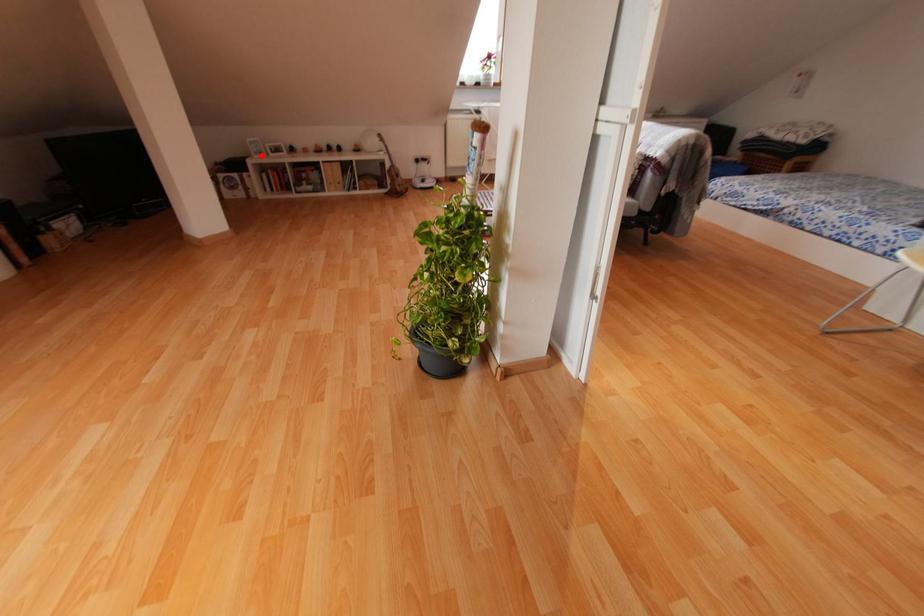
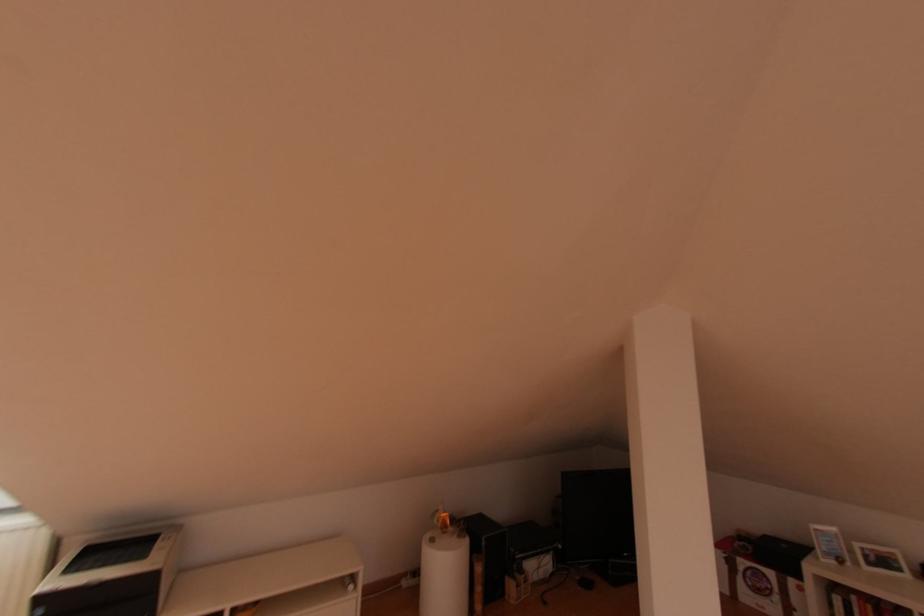
Question: I am providing you with two images of the same scene from different viewpoints. Given a red point in image1, look at the same physical point in image2. Is it:

Choices:
 (A) Closer to the viewpoint
 (B) Farther from the viewpoint

Answer: (A)